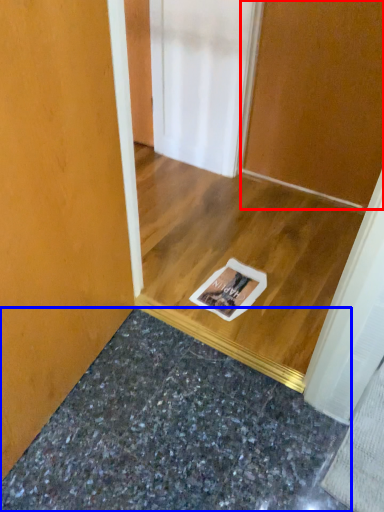
Question: Which object is closer to the camera taking this photo, door (highlighted by a red box) or granite (highlighted by a blue box)?

Choices:
 (A) door
 (B) granite

Answer: (B)